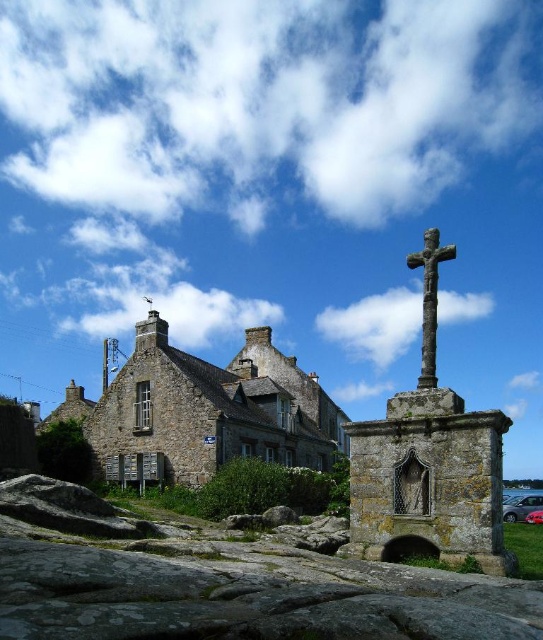
You are a tourist visiting the rural area and want to take a photo that includes both the stone church at center and the rusty stone cross at center. Since you want the cross to appear smaller in the photo compared to the church, where should you position yourself relative to them?

To make the rusty stone cross at center appear smaller than the stone church at center in the photo, you should position yourself closer to the stone church at center. Since the stone church at center is bigger than the rusty stone cross at center, being closer to the church will make it dominate the frame while the cross, being smaller, will naturally appear smaller in comparison.

You are a tourist visiting this rural area and want to take a photo of the stone church at center and the rusty stone cross at center. However, you want the cross to appear smaller in the photo compared to the church. Where should you position yourself relative to the two objects?

To make the rusty stone cross at center appear smaller than the stone church at center in the photo, you should position yourself closer to the stone church at center. Since the rusty stone cross at center is behind the stone church at center, moving closer to the church will make it larger in the frame while the cross, being farther away, will naturally appear smaller.